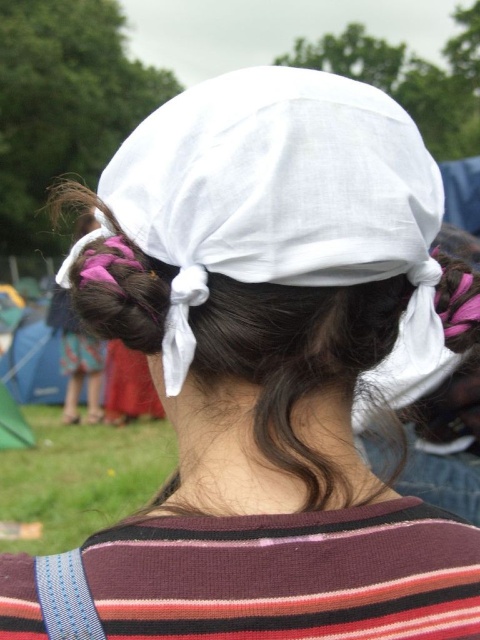
You are helping someone style their headscarf and cloth. The person has a white cotton headscarf at center and a white cloth at center. Which one should you use if you want the larger accessory for a festival outfit?

The white cotton headscarf at center is larger in size than the white cloth at center, so you should use the white cotton headscarf at center for the larger accessory in a festival outfit.